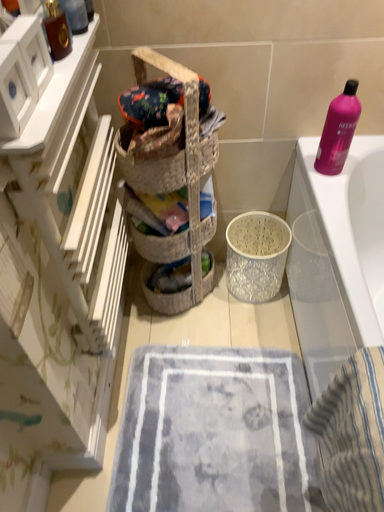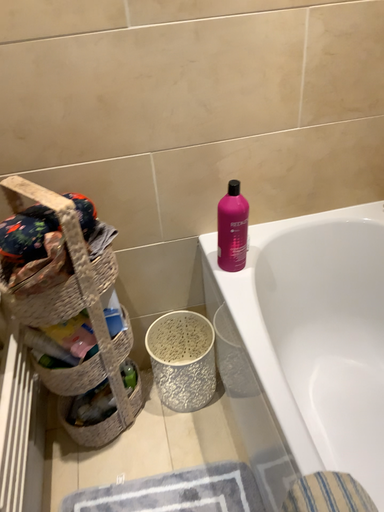
Question: Which way did the camera rotate in the video?

Choices:
 (A) rotated left
 (B) rotated right

Answer: (B)